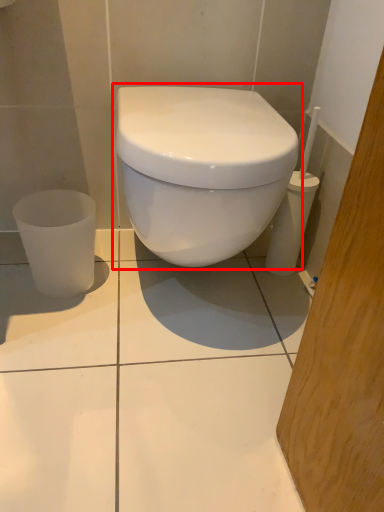
Question: From the image, what is the correct spatial relationship of toilet (annotated by the red box) in relation to porcelain?

Choices:
 (A) left
 (B) right

Answer: (B)